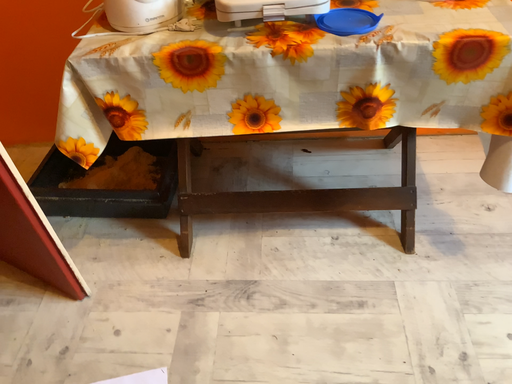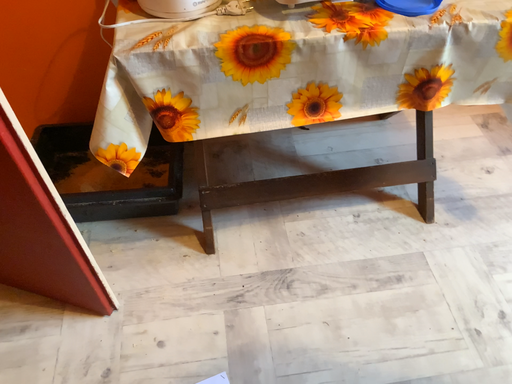
Question: Which way did the camera rotate in the video?

Choices:
 (A) rotated right
 (B) rotated left

Answer: (A)